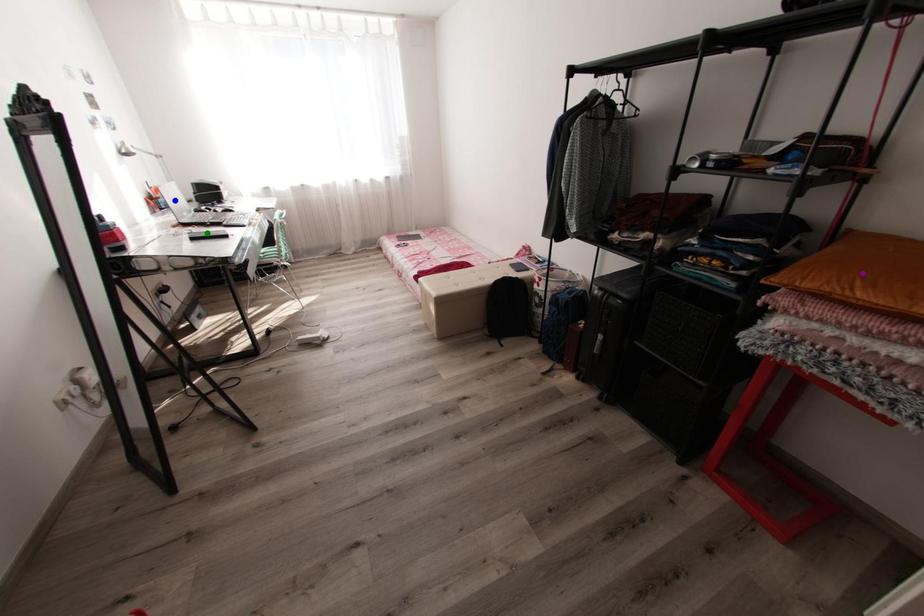
Order these from nearest to farthest:
1. blue point
2. purple point
3. green point

1. purple point
2. green point
3. blue point